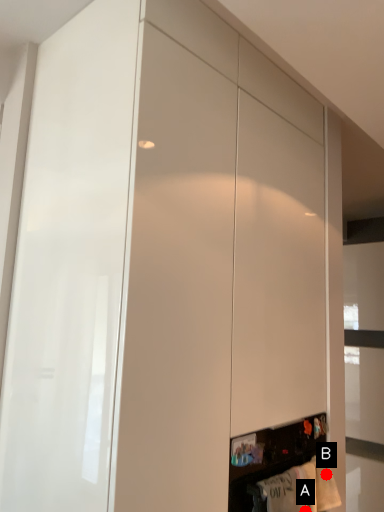
Question: Two points are circled on the image, labeled by A and B beside each circle. Which of the following is the farthest from the observer?

Choices:
 (A) A is further
 (B) B is further

Answer: (B)